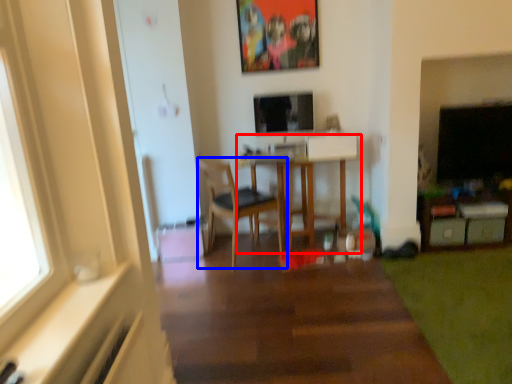
Question: Which object appears farthest to the camera in this image, table (highlighted by a red box) or chair (highlighted by a blue box)?

Choices:
 (A) table
 (B) chair

Answer: (A)